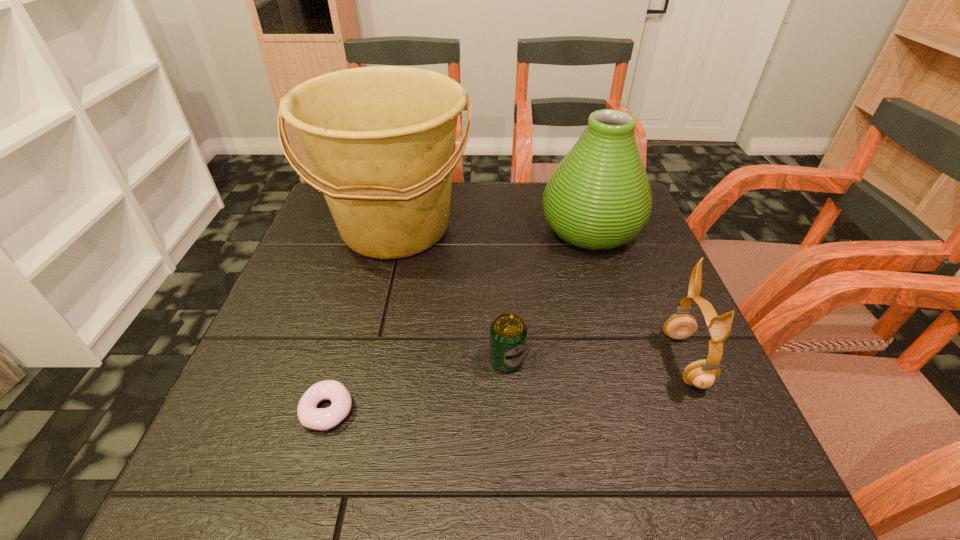
The width and height of the screenshot is (960, 540). I want to click on free space between the fourth tallest object and the second tallest object, so click(549, 294).

The image size is (960, 540). I want to click on free space that is in between the bucket and the third shortest object, so tap(540, 294).

The height and width of the screenshot is (540, 960). In order to click on empty location between the third shortest object and the second tallest object in this screenshot , I will do `click(637, 294)`.

The image size is (960, 540). I want to click on free space that is in between the bucket and the third shortest object, so click(540, 294).

Identify the location of free space between the fourth tallest object and the shortest object. This screenshot has height=540, width=960. (417, 385).

Find the location of a particular element. This screenshot has width=960, height=540. object that stands as the closest to the second shortest object is located at coordinates (381, 140).

At what (x,y) coordinates should I click in order to perform the action: click on object that can be found as the fourth closest to the earphone. Please return your answer as a coordinate pair (x, y). Image resolution: width=960 pixels, height=540 pixels. Looking at the image, I should click on (310, 416).

Where is `free space that satisfies the following two spatial constraints: 1. on the front-facing side of the earphone; 2. on the front side of the beer can`? free space that satisfies the following two spatial constraints: 1. on the front-facing side of the earphone; 2. on the front side of the beer can is located at coordinates click(x=685, y=360).

Image resolution: width=960 pixels, height=540 pixels. What are the coordinates of `free location that satisfies the following two spatial constraints: 1. on the back side of the vase; 2. on the left side of the shortest object` in the screenshot? It's located at (379, 228).

I want to click on vacant point that satisfies the following two spatial constraints: 1. on the side of the bucket with the handle; 2. on the right side of the second tallest object, so click(x=396, y=228).